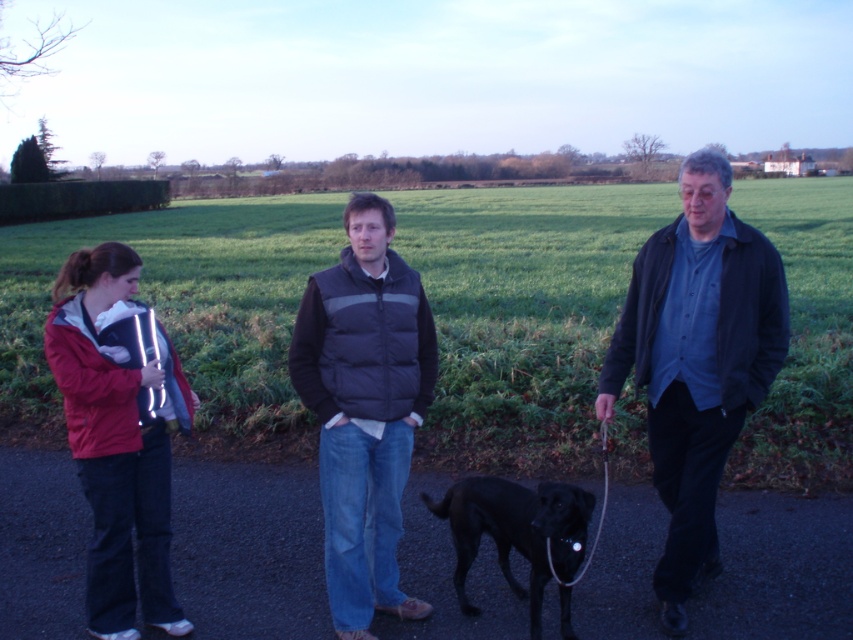
Question: Which point is closer to the camera taking this photo?

Choices:
 (A) (485, 506)
 (B) (583, 566)

Answer: (A)

Question: Does dark blue jacket at right appear under black smooth dog at center?

Choices:
 (A) no
 (B) yes

Answer: (A)

Question: Which object is farther from the camera taking this photo?

Choices:
 (A) dark blue puffer vest at center
 (B) black rubber dog leash at center
 (C) red fleece jacket at left
 (D) white nylon leash at center

Answer: (B)

Question: Which of the following is the closest to the observer?

Choices:
 (A) white nylon leash at center
 (B) black smooth dog at center

Answer: (B)

Question: Does dark blue puffer vest at center appear under white nylon leash at center?

Choices:
 (A) yes
 (B) no

Answer: (B)

Question: Can you confirm if black rubber dog leash at center is positioned below white nylon leash at center?

Choices:
 (A) yes
 (B) no

Answer: (A)